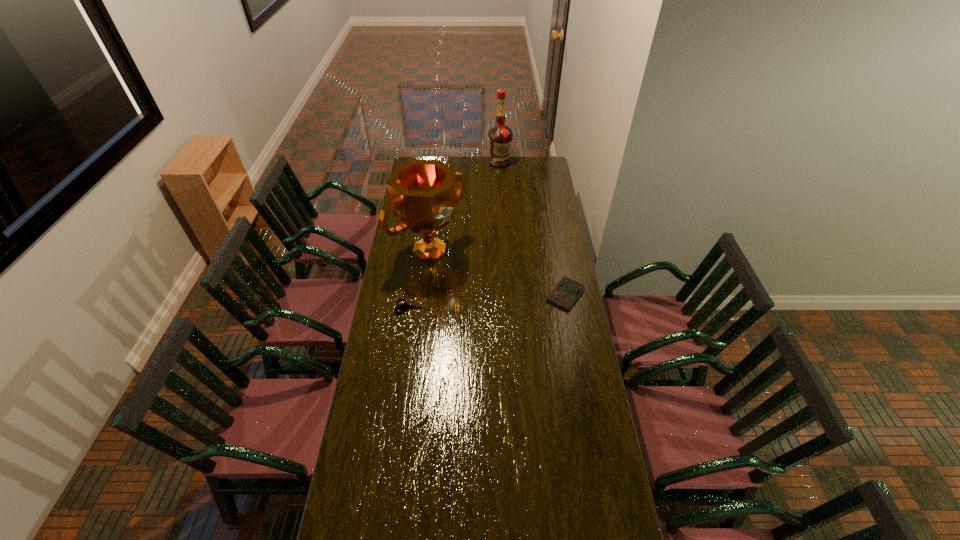
Find the location of a particular element. Image resolution: width=960 pixels, height=540 pixels. free space on the desktop that is between the shortest object and the rightmost object and is positioned on the front and back of the second object from right to left is located at coordinates (503, 300).

Locate an element on the screen. This screenshot has height=540, width=960. vacant spot on the desktop that is between the shortest object and the rightmost object and is positioned on the side of the second farthest object with the star emblem is located at coordinates (491, 301).